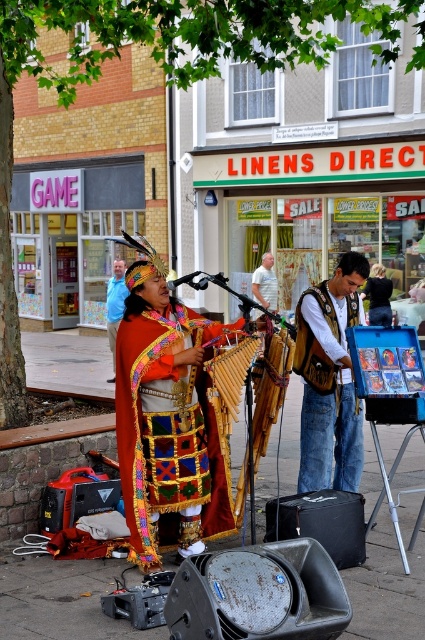
Find the location of `matte multicolored poncho at center`. matte multicolored poncho at center is located at coordinates (167, 422).

Is point (153, 516) closer to camera compared to point (365, 262)?

That is True.

What are the coordinates of `matte multicolored poncho at center` in the screenshot? It's located at (167, 422).

Can you confirm if leather vest at center is shorter than blue fabric shirt at center?

No, leather vest at center is not shorter than blue fabric shirt at center.

Is leather vest at center below blue fabric shirt at center?

Yes.

Is point (312, 420) positioned in front of point (116, 296)?

Yes, it is.

The image size is (425, 640). Identify the location of leather vest at center. point(333,381).

Is point (192, 513) closer to viewer compared to point (122, 266)?

Yes.

Locate an element on the screen. The width and height of the screenshot is (425, 640). matte multicolored poncho at center is located at coordinates (167, 422).